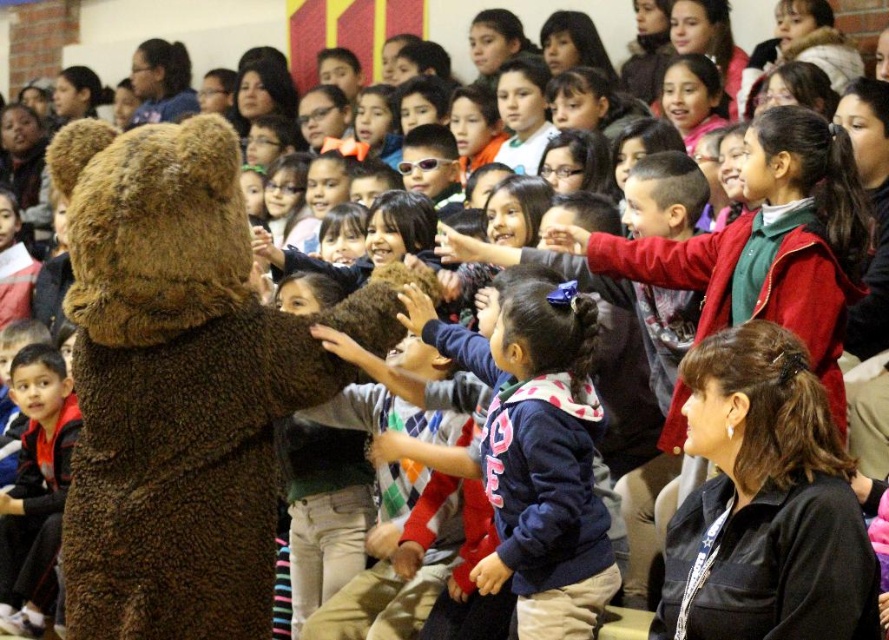
You are a teacher organizing a school event and need to ensure that the fuzzy brown bear at center and the red fleece jacket at left can both fit on a single 1.5 meter wide stage. Given their sizes, will there be enough space for both?

The fuzzy brown bear at center is larger in size than the red fleece jacket at left. Since the stage is 1.5 meters wide, and the bear is bigger, it might still fit depending on their exact dimensions. However, without specific measurements, it is uncertain if both will fit comfortably.

You are a photographer standing at the back of the auditorium. You want to take a photo of the fuzzy brown bear at center and the red fleece jacket at left. Which object will appear larger in your photo?

The fuzzy brown bear at center will appear larger in the photo because it is closer to the viewer than the red fleece jacket at left.